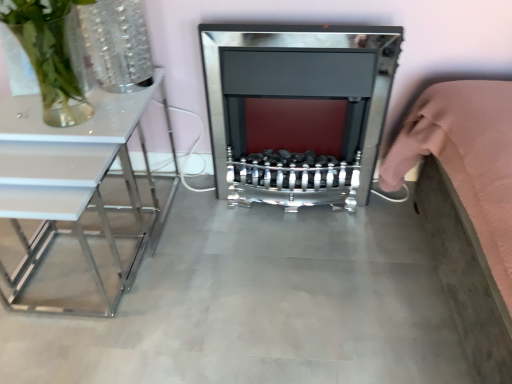
Question: Can you confirm if clear glass vase at upper left is smaller than concretesmoothfloor at center?

Choices:
 (A) no
 (B) yes

Answer: (B)

Question: Is concretesmoothfloor at center inside clear glass vase at upper left?

Choices:
 (A) no
 (B) yes

Answer: (A)

Question: Considering the relative sizes of clear glass vase at upper left and concretesmoothfloor at center in the image provided, is clear glass vase at upper left thinner than concretesmoothfloor at center?

Choices:
 (A) yes
 (B) no

Answer: (A)

Question: Can you confirm if clear glass vase at upper left is shorter than concretesmoothfloor at center?

Choices:
 (A) yes
 (B) no

Answer: (B)

Question: Is clear glass vase at upper left to the left of concretesmoothfloor at center from the viewer's perspective?

Choices:
 (A) no
 (B) yes

Answer: (B)

Question: Is clear glass vase at upper left located outside concretesmoothfloor at center?

Choices:
 (A) yes
 (B) no

Answer: (A)

Question: Is pink fabric bed at right looking in the opposite direction of white glossy table at left?

Choices:
 (A) yes
 (B) no

Answer: (B)

Question: From a real-world perspective, is pink fabric bed at right located beneath white glossy table at left?

Choices:
 (A) no
 (B) yes

Answer: (A)

Question: Is pink fabric bed at right shorter than white glossy table at left?

Choices:
 (A) yes
 (B) no

Answer: (B)

Question: Can you confirm if pink fabric bed at right is thinner than white glossy table at left?

Choices:
 (A) yes
 (B) no

Answer: (A)

Question: Does pink fabric bed at right have a larger size compared to white glossy table at left?

Choices:
 (A) yes
 (B) no

Answer: (A)

Question: Is pink fabric bed at right aimed at white glossy table at left?

Choices:
 (A) yes
 (B) no

Answer: (A)

Question: Is polished chrome fireplace at center inside concretesmoothfloor at center?

Choices:
 (A) yes
 (B) no

Answer: (B)